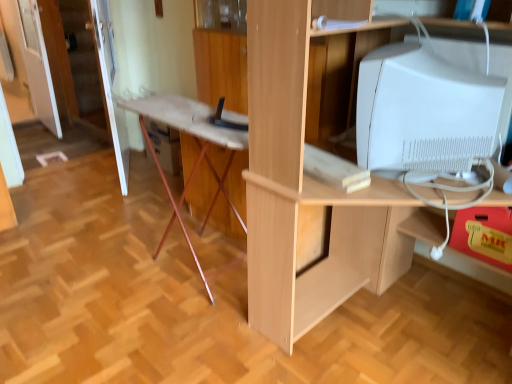
Where is `vacant region below light wood desk at center (from a real-world perspective)`? vacant region below light wood desk at center (from a real-world perspective) is located at coordinates (403, 324).